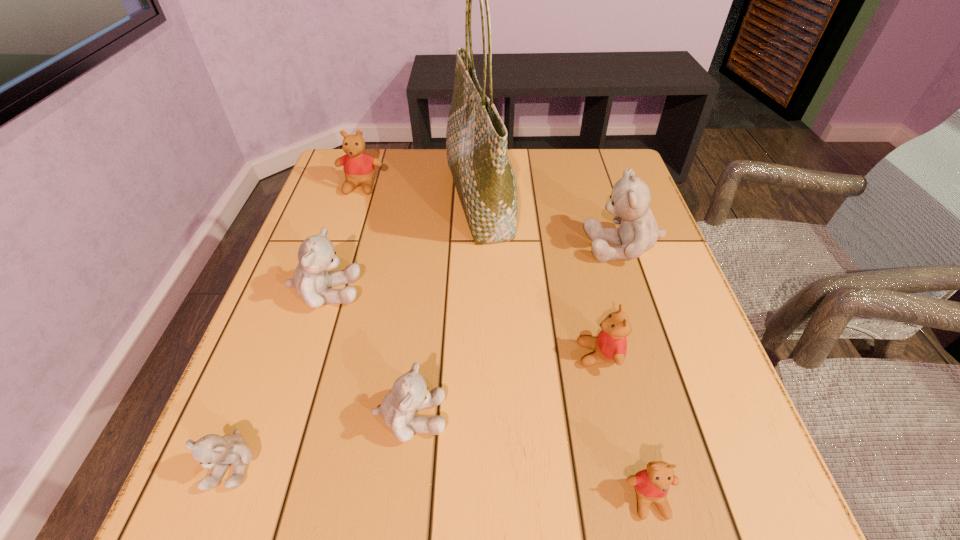
Image resolution: width=960 pixels, height=540 pixels. In order to click on the second gray teddy bear from right to left in this screenshot , I will do `click(409, 394)`.

You are a GUI agent. You are given a task and a screenshot of the screen. Output one action in this format:
    pyautogui.click(x=<x>, y=<y>)
    Task: Click on the third biggest gray teddy bear
    The image size is (960, 540).
    Given the screenshot: What is the action you would take?
    pyautogui.click(x=409, y=394)

This screenshot has width=960, height=540. I want to click on the smallest red teddy bear, so click(x=652, y=484).

Identify the location of the smallest gray teddy bear. (213, 451).

At what (x,y) coordinates should I click in order to perform the action: click on free space located 0.130m on the right of the green shopping bag. Please return your answer as a coordinate pair (x, y). This screenshot has width=960, height=540. Looking at the image, I should click on (564, 200).

Find the location of `vacant space located 0.130m on the face of the farthest gray teddy bear`. vacant space located 0.130m on the face of the farthest gray teddy bear is located at coordinates click(527, 246).

Locate an element on the screen. vacant area situated 0.270m on the face of the farthest gray teddy bear is located at coordinates (467, 246).

This screenshot has width=960, height=540. I want to click on vacant space located on the face of the farthest gray teddy bear, so click(441, 246).

Where is `free space located on the front-facing side of the leftmost red teddy bear`? This screenshot has height=540, width=960. free space located on the front-facing side of the leftmost red teddy bear is located at coordinates (323, 301).

You are a GUI agent. You are given a task and a screenshot of the screen. Output one action in this format:
    pyautogui.click(x=<x>, y=<y>)
    Task: Click on the free region located 0.210m on the face of the fifth nearest teddy bear
    The width and height of the screenshot is (960, 540).
    Given the screenshot: What is the action you would take?
    pyautogui.click(x=463, y=292)